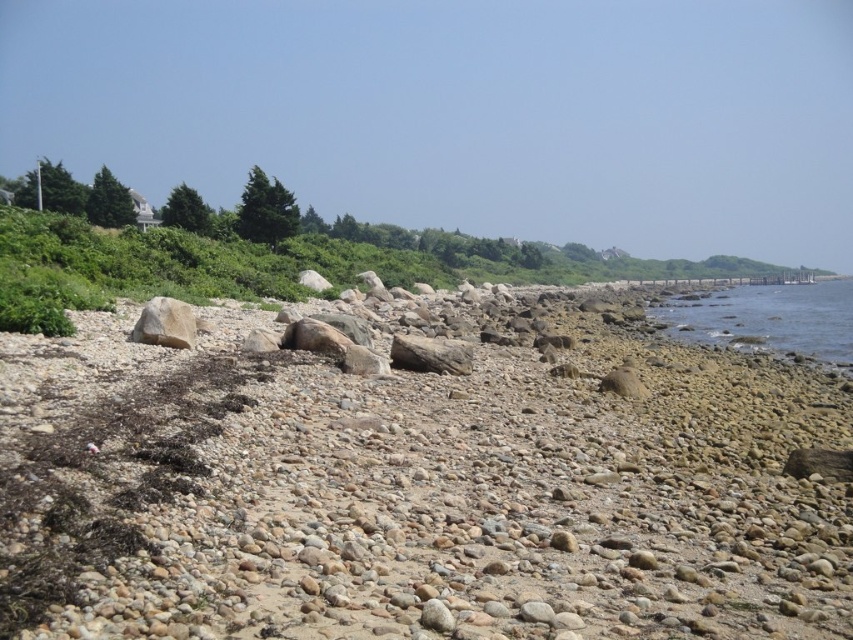
Question: Which point is farther to the camera?

Choices:
 (A) smooth pebbles at center
 (B) clear water at lower right
 (C) smooth beige rock at center-left

Answer: (B)

Question: From the image, what is the correct spatial relationship of smooth pebbles at center in relation to clear water at lower right?

Choices:
 (A) below
 (B) above

Answer: (A)

Question: Which of these objects is positioned farthest from the smooth pebbles at center?

Choices:
 (A) clear water at lower right
 (B) smooth beige rock at center-left

Answer: (A)

Question: From the image, what is the correct spatial relationship of clear water at lower right in relation to smooth beige rock at center-left?

Choices:
 (A) below
 (B) above

Answer: (B)

Question: Considering the real-world distances, which object is farthest from the smooth pebbles at center?

Choices:
 (A) smooth beige rock at center-left
 (B) clear water at lower right

Answer: (B)

Question: Is smooth pebbles at center behind clear water at lower right?

Choices:
 (A) no
 (B) yes

Answer: (A)